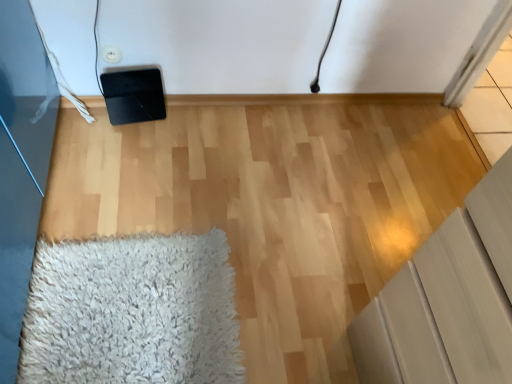
Identify the location of matte gray cabinet at lower right. (448, 300).

The image size is (512, 384). Describe the element at coordinates (448, 300) in the screenshot. I see `matte gray cabinet at lower right` at that location.

I want to click on white shaggy rug at lower left, so click(x=132, y=312).

The height and width of the screenshot is (384, 512). What do you see at coordinates (132, 312) in the screenshot?
I see `white shaggy rug at lower left` at bounding box center [132, 312].

At what (x,y) coordinates should I click in order to perform the action: click on matte gray cabinet at lower right. Please return your answer as a coordinate pair (x, y). Image resolution: width=512 pixels, height=384 pixels. Looking at the image, I should click on (448, 300).

Which is more to the left, white shaggy rug at lower left or matte gray cabinet at lower right?

white shaggy rug at lower left.

Who is more distant, white shaggy rug at lower left or matte gray cabinet at lower right?

white shaggy rug at lower left.

Which point is more distant from viewer, (48, 326) or (460, 372)?

The point (48, 326) is more distant.

From the image's perspective, which is below, white shaggy rug at lower left or matte gray cabinet at lower right?

white shaggy rug at lower left appears lower in the image.

From a real-world perspective, between white shaggy rug at lower left and matte gray cabinet at lower right, who is vertically higher?

From a 3D spatial view, matte gray cabinet at lower right is above.

Considering the sizes of objects white shaggy rug at lower left and matte gray cabinet at lower right in the image provided, who is wider, white shaggy rug at lower left or matte gray cabinet at lower right?

Wider between the two is white shaggy rug at lower left.

Is white shaggy rug at lower left shorter than matte gray cabinet at lower right?

Indeed, white shaggy rug at lower left has a lesser height compared to matte gray cabinet at lower right.

Considering the relative sizes of white shaggy rug at lower left and matte gray cabinet at lower right in the image provided, is white shaggy rug at lower left smaller than matte gray cabinet at lower right?

Correct, white shaggy rug at lower left occupies less space than matte gray cabinet at lower right.

Is white shaggy rug at lower left inside the boundaries of matte gray cabinet at lower right, or outside?

white shaggy rug at lower left is located beyond the bounds of matte gray cabinet at lower right.

Would you consider white shaggy rug at lower left to be distant from matte gray cabinet at lower right?

No, there isn't a large distance between white shaggy rug at lower left and matte gray cabinet at lower right.

Is white shaggy rug at lower left oriented towards matte gray cabinet at lower right?

No, white shaggy rug at lower left is not turned towards matte gray cabinet at lower right.

Where is `mat below the matte gray cabinet at lower right (from the image's perspective)`? This screenshot has width=512, height=384. mat below the matte gray cabinet at lower right (from the image's perspective) is located at coordinates (132, 312).

Which is more to the right, matte gray cabinet at lower right or white shaggy rug at lower left?

matte gray cabinet at lower right is more to the right.

Consider the image. Is matte gray cabinet at lower right in front of or behind white shaggy rug at lower left in the image?

matte gray cabinet at lower right is in front of white shaggy rug at lower left.

Is point (441, 315) positioned before point (158, 273)?

Yes, it is.

From the image's perspective, is matte gray cabinet at lower right located beneath white shaggy rug at lower left?

No, from the image's perspective, matte gray cabinet at lower right is not beneath white shaggy rug at lower left.

From a real-world perspective, between matte gray cabinet at lower right and white shaggy rug at lower left, who is vertically lower?

In real-world perspective, white shaggy rug at lower left is lower.

Considering the sizes of matte gray cabinet at lower right and white shaggy rug at lower left in the image, is matte gray cabinet at lower right wider or thinner than white shaggy rug at lower left?

Considering their sizes, matte gray cabinet at lower right looks slimmer than white shaggy rug at lower left.

Can you confirm if matte gray cabinet at lower right is taller than white shaggy rug at lower left?

Yes, matte gray cabinet at lower right is taller than white shaggy rug at lower left.

Is matte gray cabinet at lower right smaller than white shaggy rug at lower left?

Actually, matte gray cabinet at lower right might be larger than white shaggy rug at lower left.

Do you think matte gray cabinet at lower right is within white shaggy rug at lower left, or outside of it?

→ matte gray cabinet at lower right is spatially situated outside white shaggy rug at lower left.

Would you say matte gray cabinet at lower right is a long distance from white shaggy rug at lower left?

No, matte gray cabinet at lower right is not far from white shaggy rug at lower left.

Does matte gray cabinet at lower right turn towards white shaggy rug at lower left?

Yes, matte gray cabinet at lower right faces towards white shaggy rug at lower left.

How many degrees apart are the facing directions of matte gray cabinet at lower right and white shaggy rug at lower left?

89.6 degrees.

How much distance is there between matte gray cabinet at lower right and white shaggy rug at lower left?

matte gray cabinet at lower right and white shaggy rug at lower left are 26.07 inches apart from each other.

In order to click on mat directly beneath the matte gray cabinet at lower right (from a real-world perspective) in this screenshot , I will do `click(132, 312)`.

Identify the location of furniture that appears above the white shaggy rug at lower left (from a real-world perspective). Image resolution: width=512 pixels, height=384 pixels. [448, 300].

In the image, there is a matte gray cabinet at lower right. Where is `mat below it (from the image's perspective)`? Image resolution: width=512 pixels, height=384 pixels. mat below it (from the image's perspective) is located at coordinates (132, 312).